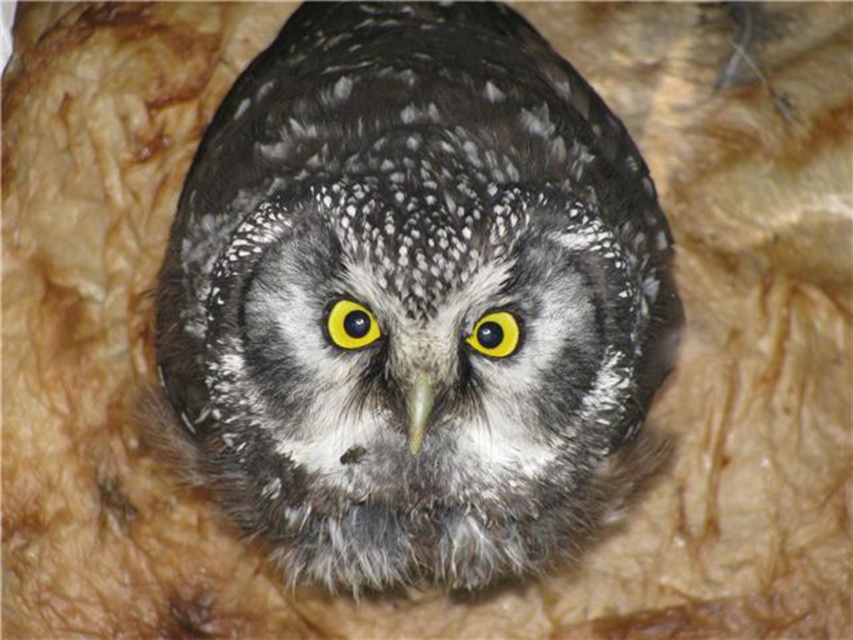
What are the coordinates of the speckled feathered owl at center?

The coordinates of the speckled feathered owl at center are at point (415,296).

You are standing in front of the owl and notice two points marked on its head. The first point is at coordinates point (337, 337) and the second is at point (421, 390). Which point is closer to your viewpoint?

Point (421, 390) is closer to your viewpoint because the description states that point (337, 337) is behind point (421, 390).

You are a birdwatcher observing this owl. You notice the yellow shiny eye at center and the green matte beak at center. Which object is positioned higher on the owl?

The yellow shiny eye at center is positioned higher than the green matte beak at center.